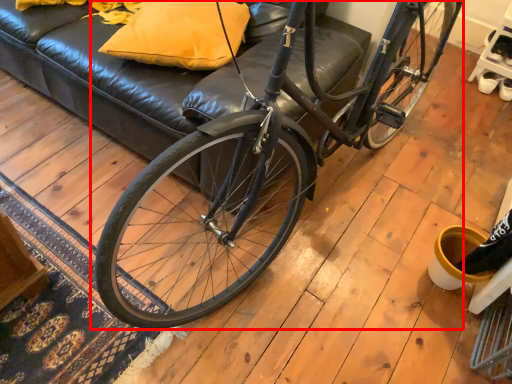
Question: From the image's perspective, what is the correct spatial positioning of bicycle (annotated by the red box) in reference to pillow?

Choices:
 (A) below
 (B) above

Answer: (A)